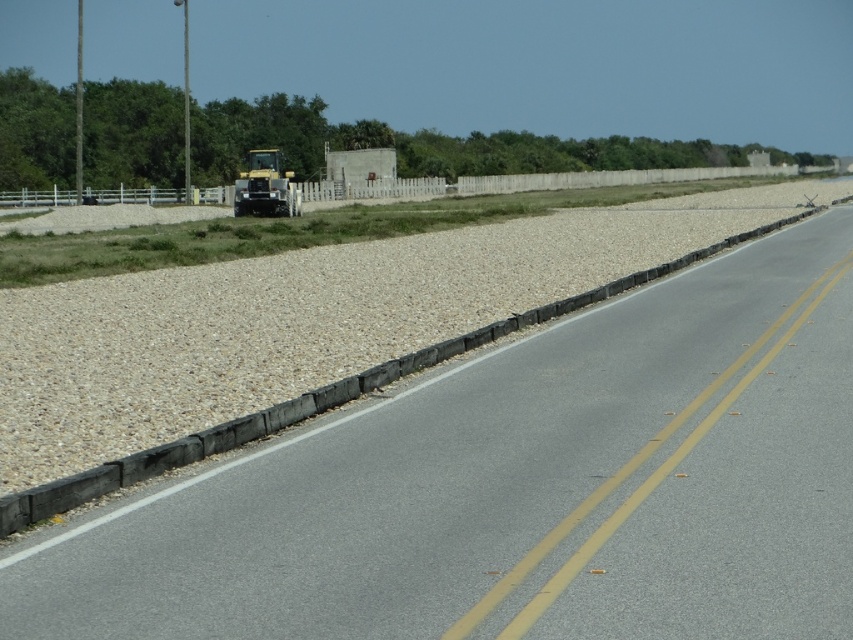
Question: Is asphalt road at center above yellow metallic tractor at center?

Choices:
 (A) yes
 (B) no

Answer: (B)

Question: Does asphalt road at center have a smaller size compared to yellow metallic tractor at center?

Choices:
 (A) yes
 (B) no

Answer: (A)

Question: Among these points, which one is nearest to the camera?

Choices:
 (A) (836, 570)
 (B) (271, 209)

Answer: (A)

Question: Does asphalt road at center lie behind yellow metallic tractor at center?

Choices:
 (A) yes
 (B) no

Answer: (B)

Question: Which object appears closest to the camera in this image?

Choices:
 (A) asphalt road at center
 (B) yellow metallic tractor at center

Answer: (A)